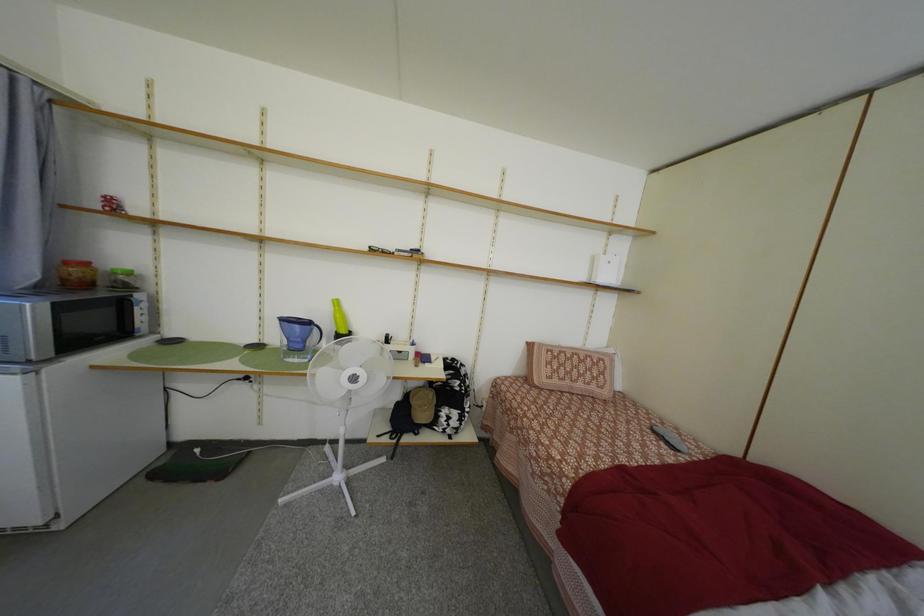
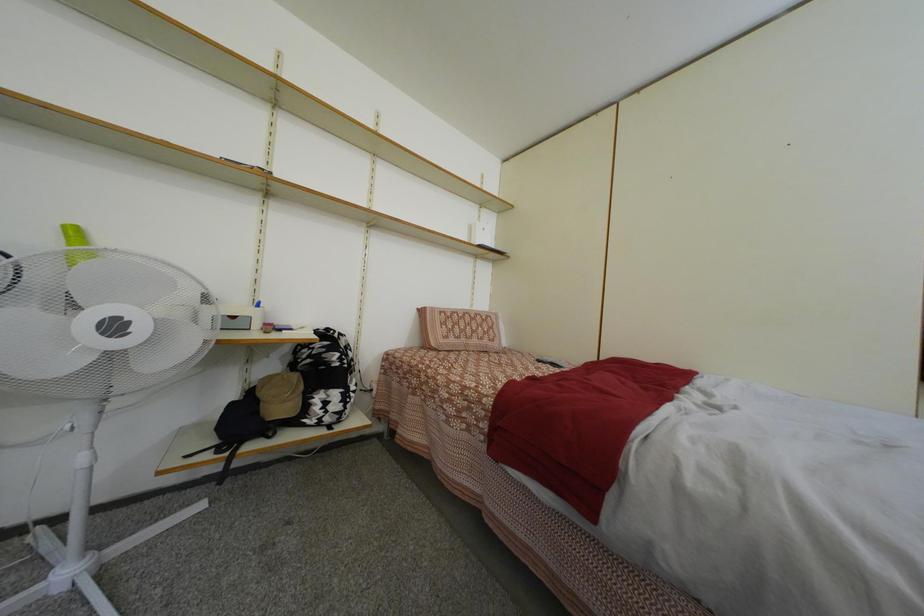
Question: The camera is either moving clockwise (left) or counter-clockwise (right) around the object. The first image is from the beginning of the video and the second image is from the end. Is the camera moving left or right when shooting the video?

Choices:
 (A) Left
 (B) Right

Answer: (A)